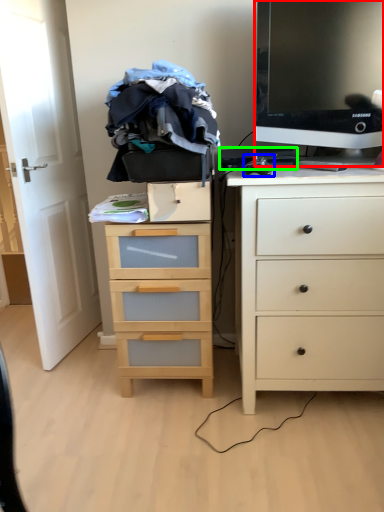
Question: Considering the real-world distances, which object is closest to television (highlighted by a red box)? computer mouse (highlighted by a blue box) or computer keyboard (highlighted by a green box).

Choices:
 (A) computer mouse
 (B) computer keyboard

Answer: (B)